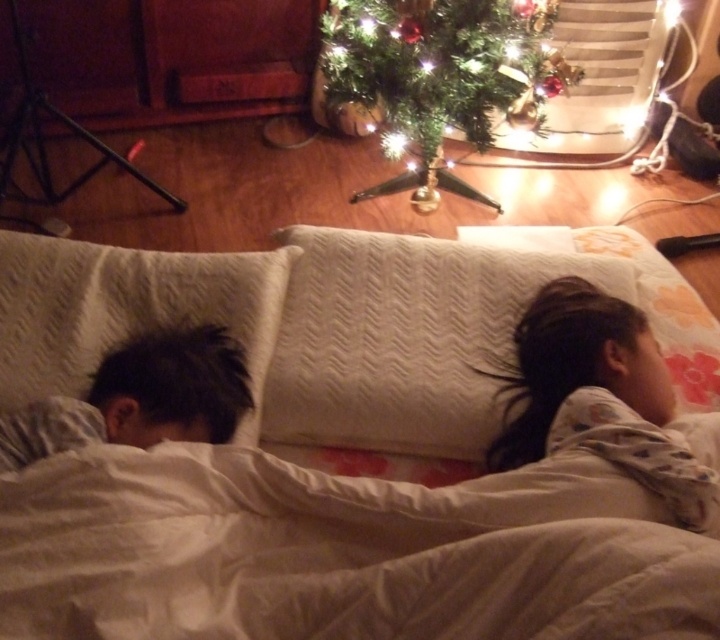
In the scene shown: Who is more distant from viewer, (44,378) or (132,432)?

The point (44,378) is more distant.

Which is behind, point (258, 340) or point (156, 410)?

Point (258, 340)

Locate an element on the screen. white textured pillow at left is located at coordinates (125, 308).

Which is more to the right, white textured pillow at left or light brown hair at right?

light brown hair at right

Describe the element at coordinates (125, 308) in the screenshot. I see `white textured pillow at left` at that location.

Find the location of a particular element. white textured pillow at left is located at coordinates (125, 308).

Where is `white textured pillow at left`? This screenshot has height=640, width=720. white textured pillow at left is located at coordinates [x=125, y=308].

Who is more distant from viewer, (498, 500) or (472, 406)?

The point (472, 406) is behind.

Is white soft bed at center above white textured pillow at center?

No.

Which is in front, point (487, 492) or point (456, 417)?

Point (487, 492) is in front.

Where is `white soft bed at center`? The width and height of the screenshot is (720, 640). white soft bed at center is located at coordinates (341, 444).